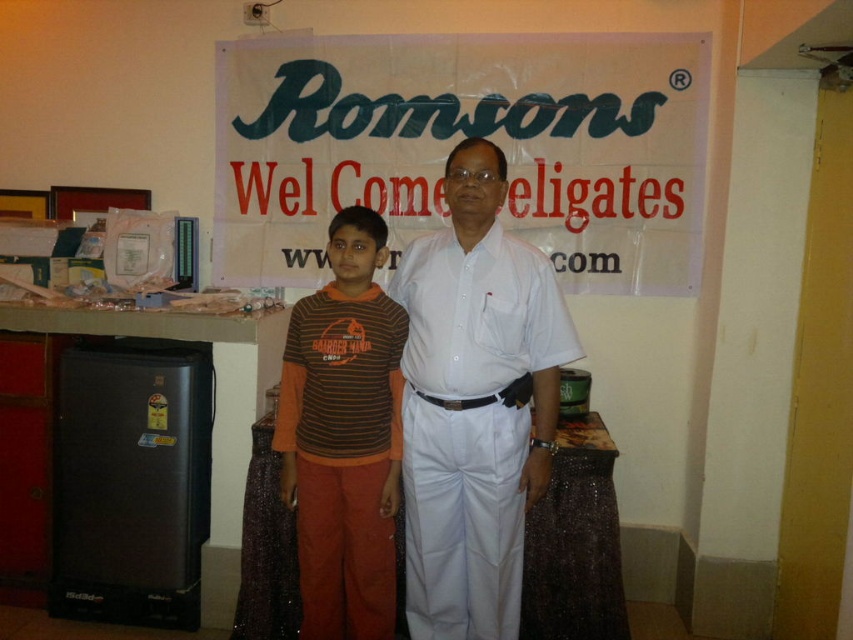
Question: Does white cotton shirt at center appear on the right side of brown striped shirt at center?

Choices:
 (A) no
 (B) yes

Answer: (B)

Question: Does white cotton shirt at center have a smaller size compared to brown striped shirt at center?

Choices:
 (A) no
 (B) yes

Answer: (A)

Question: Among these objects, which one is nearest to the camera?

Choices:
 (A) white cotton shirt at center
 (B) brown striped shirt at center

Answer: (A)

Question: Is white cotton shirt at center above brown striped shirt at center?

Choices:
 (A) no
 (B) yes

Answer: (B)

Question: Which point is farther to the camera?

Choices:
 (A) coord(396,328)
 (B) coord(413,362)

Answer: (A)